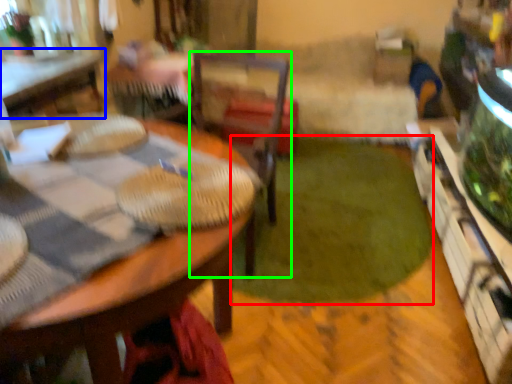
Question: Based on their relative distances, which object is farther from grass (highlighted by a red box)? Choose from table (highlighted by a blue box) and chair (highlighted by a green box).

Choices:
 (A) table
 (B) chair

Answer: (A)